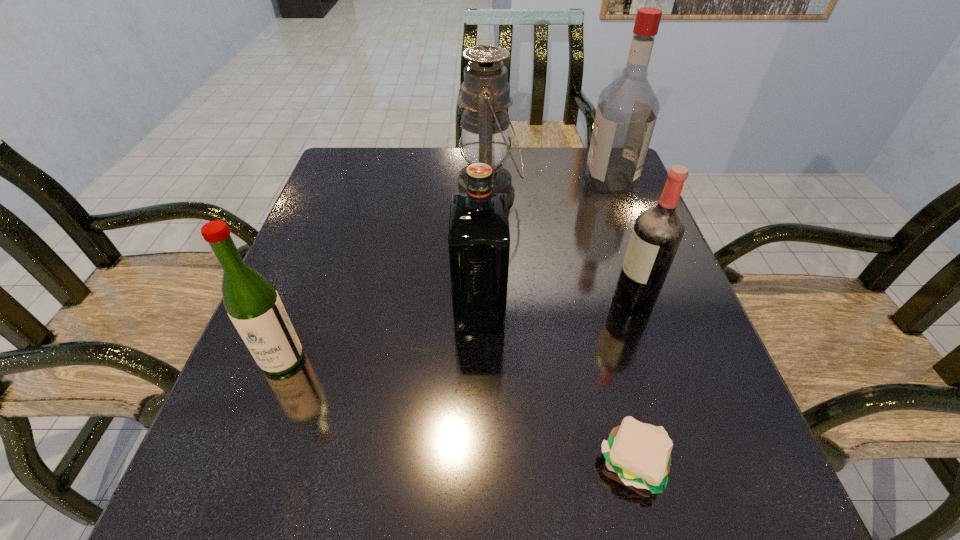
Where is `object that is positioned at the near right corner`? This screenshot has width=960, height=540. object that is positioned at the near right corner is located at coordinates (639, 453).

In the image, there is a desktop. At what (x,y) coordinates should I click in order to perform the action: click on vacant space at the far edge. Please return your answer as a coordinate pair (x, y). Looking at the image, I should click on (549, 163).

Locate an element on the screen. This screenshot has height=540, width=960. vacant region at the near edge is located at coordinates (658, 496).

Where is `free spot at the left edge of the desktop`? This screenshot has height=540, width=960. free spot at the left edge of the desktop is located at coordinates (347, 296).

The image size is (960, 540). I want to click on vacant space at the right edge of the desktop, so click(x=604, y=274).

Identify the location of free space at the far left corner of the desktop. This screenshot has height=540, width=960. (371, 185).

This screenshot has height=540, width=960. In order to click on vacant area at the near left corner in this screenshot , I will do `click(288, 504)`.

Image resolution: width=960 pixels, height=540 pixels. I want to click on vacant region at the near right corner of the desktop, so click(x=701, y=527).

The image size is (960, 540). What are the coordinates of `free space between the shortest object and the tallest liquor` in the screenshot? It's located at (622, 322).

Identify the location of free space between the leftmost object and the third liquor from right to left. Image resolution: width=960 pixels, height=540 pixels. (381, 333).